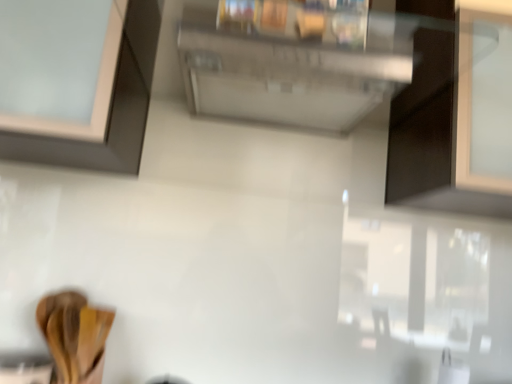
The height and width of the screenshot is (384, 512). Describe the element at coordinates (290, 65) in the screenshot. I see `satin silver vent at upper center` at that location.

Identify the location of satin silver vent at upper center. This screenshot has width=512, height=384. (290, 65).

Identify the location of satin silver vent at upper center. The width and height of the screenshot is (512, 384). (290, 65).